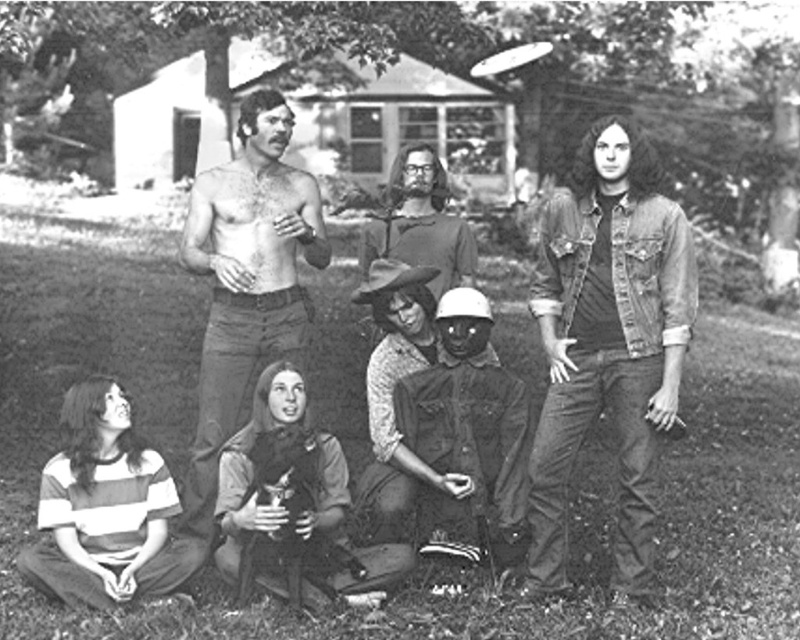
Based on the photo, can you confirm if denim shirt at center is positioned below denim jacket at center?

Yes.

Does denim shirt at center have a smaller size compared to denim jacket at center?

Actually, denim shirt at center might be larger than denim jacket at center.

Between point (594, 396) and point (444, 220), which one is positioned in front?

Positioned in front is point (594, 396).

At what (x,y) coordinates should I click in order to perform the action: click on denim shirt at center. Please return your answer as a coordinate pair (x, y). Looking at the image, I should click on (608, 340).

Who is taller, grass at lower center or denim jacket at center?

grass at lower center

Between point (754, 621) and point (392, 198), which one is positioned in front?

Positioned in front is point (754, 621).

Identify the location of grass at lower center. point(154,428).

This screenshot has height=640, width=800. Describe the element at coordinates (154, 428) in the screenshot. I see `grass at lower center` at that location.

Which is in front, point (60, 392) or point (542, 316)?

Point (542, 316) is more forward.

The image size is (800, 640). Describe the element at coordinates (154, 428) in the screenshot. I see `grass at lower center` at that location.

Find the location of a particular element. The height and width of the screenshot is (640, 800). grass at lower center is located at coordinates (154, 428).